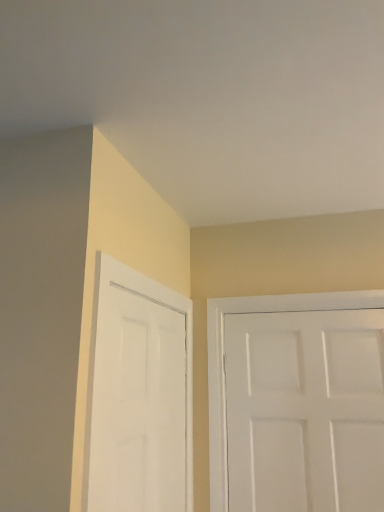
What is the approximate height of white matte door at left, placed as the 2th door when sorted from right to left?

The height of white matte door at left, placed as the 2th door when sorted from right to left, is 31.75 inches.

Describe the element at coordinates (138, 404) in the screenshot. I see `white matte door at left, placed as the 2th door when sorted from right to left` at that location.

This screenshot has width=384, height=512. Identify the location of white matte door at left, the first door positioned from the left. (138, 404).

Measure the distance between white matte door at left, placed as the 2th door when sorted from right to left, and camera.

white matte door at left, placed as the 2th door when sorted from right to left, and camera are 3.32 feet apart from each other.

At what (x,y) coordinates should I click in order to perform the action: click on white matte door at right, which is counted as the second door, starting from the left. Please return your answer as a coordinate pair (x, y). Looking at the image, I should click on (305, 411).

The height and width of the screenshot is (512, 384). Describe the element at coordinates (305, 411) in the screenshot. I see `white matte door at right, the first door from the right` at that location.

At what (x,y) coordinates should I click in order to perform the action: click on white matte door at left, placed as the 2th door when sorted from right to left. Please return your answer as a coordinate pair (x, y). The height and width of the screenshot is (512, 384). Looking at the image, I should click on (138, 404).

Can you confirm if white matte door at right, which is counted as the second door, starting from the left, is positioned to the right of white matte door at left, the first door positioned from the left?

Yes, white matte door at right, which is counted as the second door, starting from the left, is to the right of white matte door at left, the first door positioned from the left.

Considering their positions, is white matte door at right, the first door from the right, located in front of or behind white matte door at left, the first door positioned from the left?

Visually, white matte door at right, the first door from the right, is located behind white matte door at left, the first door positioned from the left.

Which is nearer, (253, 505) or (119, 285)?

Clearly, point (253, 505) is more distant from the camera than point (119, 285).

From the image's perspective, does white matte door at right, which is counted as the second door, starting from the left, appear lower than white matte door at left, placed as the 2th door when sorted from right to left?

Yes.

From a real-world perspective, is white matte door at right, the first door from the right, on top of white matte door at left, placed as the 2th door when sorted from right to left?

No, from a real-world perspective, white matte door at right, the first door from the right, is not on top of white matte door at left, placed as the 2th door when sorted from right to left.

Which of these two, white matte door at right, the first door from the right, or white matte door at left, the first door positioned from the left, is wider?

With larger width is white matte door at right, the first door from the right.

Is white matte door at right, the first door from the right, taller than white matte door at left, placed as the 2th door when sorted from right to left?

Yes.

Which of these two, white matte door at right, the first door from the right, or white matte door at left, the first door positioned from the left, is smaller?

white matte door at right, the first door from the right.

Is white matte door at left, the first door positioned from the left, a part of white matte door at right, the first door from the right?

Definitely not — white matte door at left, the first door positioned from the left, is not inside white matte door at right, the first door from the right.

Are white matte door at right, the first door from the right, and white matte door at left, the first door positioned from the left, beside each other?

No, white matte door at right, the first door from the right, is not in contact with white matte door at left, the first door positioned from the left.

Is white matte door at right, the first door from the right, turned away from white matte door at left, the first door positioned from the left?

white matte door at right, the first door from the right, is not turned away from white matte door at left, the first door positioned from the left.

Locate an element on the screen. This screenshot has width=384, height=512. door below the white matte door at left, placed as the 2th door when sorted from right to left (from a real-world perspective) is located at coordinates (305, 411).

Is white matte door at left, placed as the 2th door when sorted from right to left, at the right side of white matte door at right, which is counted as the second door, starting from the left?

No, white matte door at left, placed as the 2th door when sorted from right to left, is not to the right of white matte door at right, which is counted as the second door, starting from the left.

Looking at this image, which is in front, white matte door at left, the first door positioned from the left, or white matte door at right, the first door from the right?

white matte door at left, the first door positioned from the left, is more forward.

Does point (172, 356) appear closer or farther from the camera than point (273, 435)?

Point (172, 356) is closer to the camera than point (273, 435).

From the image's perspective, is white matte door at left, the first door positioned from the left, positioned above or below white matte door at right, the first door from the right?

Based on their image positions, white matte door at left, the first door positioned from the left, is located above white matte door at right, the first door from the right.

From a real-world perspective, who is located higher, white matte door at left, placed as the 2th door when sorted from right to left, or white matte door at right, the first door from the right?

white matte door at left, placed as the 2th door when sorted from right to left, from a real-world perspective.

Which of these two, white matte door at left, the first door positioned from the left, or white matte door at right, which is counted as the second door, starting from the left, is wider?

Wider between the two is white matte door at right, which is counted as the second door, starting from the left.

Considering the relative sizes of white matte door at left, the first door positioned from the left, and white matte door at right, the first door from the right, in the image provided, is white matte door at left, the first door positioned from the left, taller than white matte door at right, the first door from the right,?

Incorrect, the height of white matte door at left, the first door positioned from the left, is not larger of that of white matte door at right, the first door from the right.

Between white matte door at left, placed as the 2th door when sorted from right to left, and white matte door at right, which is counted as the second door, starting from the left, which one has smaller size?

white matte door at right, which is counted as the second door, starting from the left.

Consider the image. Can we say white matte door at left, placed as the 2th door when sorted from right to left, lies outside white matte door at right, the first door from the right?

Yes.

Consider the image. Is white matte door at left, the first door positioned from the left, in contact with white matte door at right, which is counted as the second door, starting from the left?

No, white matte door at left, the first door positioned from the left, is not in contact with white matte door at right, which is counted as the second door, starting from the left.

Is white matte door at left, placed as the 2th door when sorted from right to left, aimed at white matte door at right, the first door from the right?

Yes, white matte door at left, placed as the 2th door when sorted from right to left, is turned towards white matte door at right, the first door from the right.

How different are the orientations of white matte door at left, placed as the 2th door when sorted from right to left, and white matte door at right, which is counted as the second door, starting from the left, in degrees?

They differ by 90.2 degrees in their facing directions.

Where is `door in front of the white matte door at right, the first door from the right`? Image resolution: width=384 pixels, height=512 pixels. door in front of the white matte door at right, the first door from the right is located at coordinates (138, 404).

This screenshot has width=384, height=512. What are the coordinates of `door on the left of white matte door at right, which is counted as the second door, starting from the left` in the screenshot? It's located at (138, 404).

Find the location of `door behind the white matte door at left, the first door positioned from the left`. door behind the white matte door at left, the first door positioned from the left is located at coordinates (305, 411).